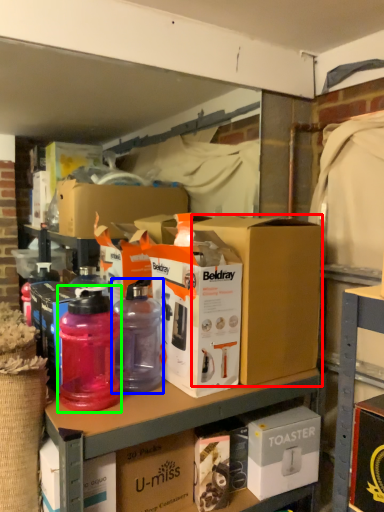
Question: Estimate the real-world distances between objects in this image. Which object is farther from box (highlighted by a red box), bottle (highlighted by a blue box) or bottle (highlighted by a green box)?

Choices:
 (A) bottle
 (B) bottle

Answer: (B)